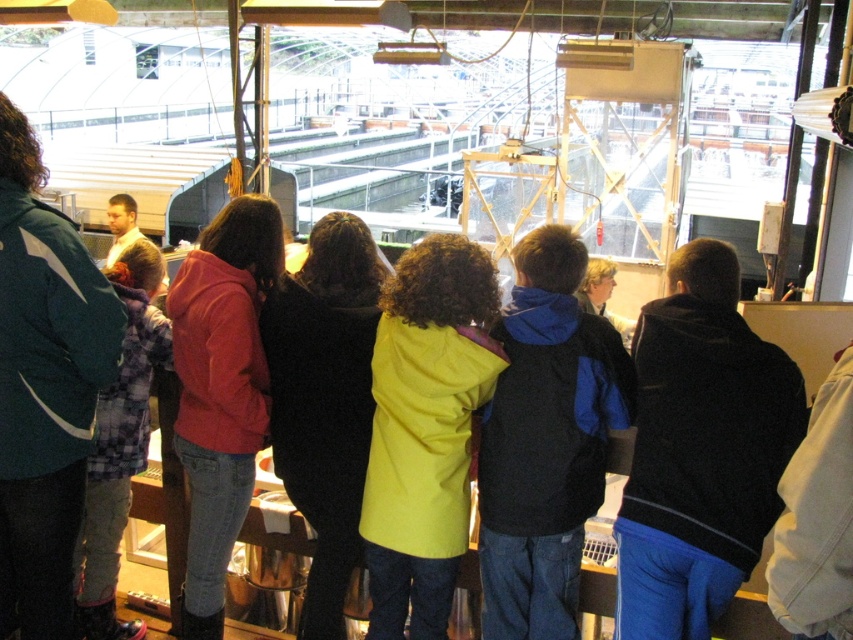
Looking at this image, between black fleece jacket at center and blue fleece jacket at center, which one is positioned higher?

black fleece jacket at center is above.

Does black fleece jacket at center have a smaller size compared to blue fleece jacket at center?

Actually, black fleece jacket at center might be larger than blue fleece jacket at center.

You are a GUI agent. You are given a task and a screenshot of the screen. Output one action in this format:
    pyautogui.click(x=<x>, y=<y>)
    Task: Click on the black fleece jacket at center
    This screenshot has height=640, width=853.
    Given the screenshot: What is the action you would take?
    pyautogui.click(x=700, y=451)

Does black fleece jacket at center have a greater width compared to matte red jacket at center?

Yes.

Is black fleece jacket at center positioned at the back of matte red jacket at center?

No, black fleece jacket at center is closer to the viewer.

Which is behind, point (683, 426) or point (192, 536)?

The point (192, 536) is behind.

At what (x,y) coordinates should I click in order to perform the action: click on black fleece jacket at center. Please return your answer as a coordinate pair (x, y). Looking at the image, I should click on pos(700,451).

Is yellow matte coat at center further to the viewer compared to matte red jacket at center?

No.

Between point (447, 516) and point (251, 440), which one is positioned in front?

Point (447, 516)

This screenshot has width=853, height=640. Identify the location of yellow matte coat at center. (425, 429).